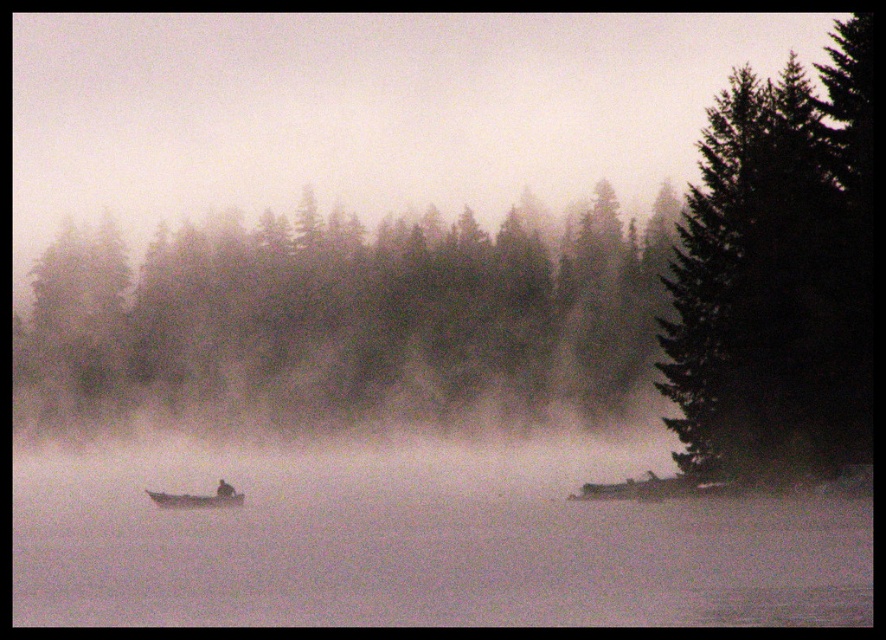
From the picture: You are standing on the lakeshore and see the dark green textured tree at right and the wooden boat at center. Which object is positioned to the right of the other?

The dark green textured tree at right is to the right of the wooden boat at center.

You are an observer standing on the lakeshore looking out at the scene. Which of the two trees, the green matte trees at center or the dark green textured tree at right, appears closer to you based on their positions in the image?

The dark green textured tree at right appears closer to you because it is positioned lower in the image, which typically indicates it is nearer to the observer compared to the green matte trees at center that are higher up.

You are planning to take a photo of the green matte trees at center and the wooden boat at center from a distance. Which object will appear bigger in the photo?

The green matte trees at center will appear bigger in the photo because they are larger in size than the wooden boat at center.